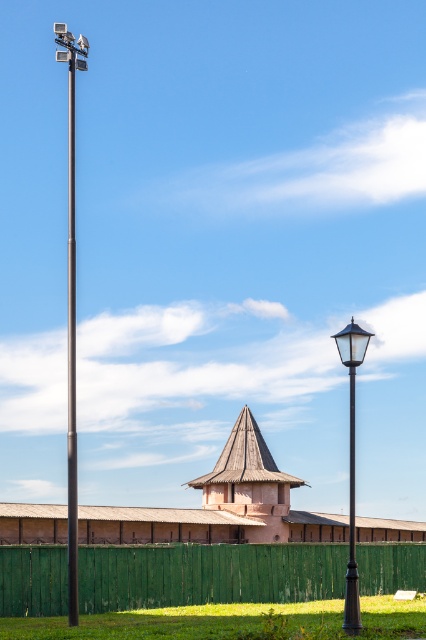
Question: Does green grass at lower center lie behind metallic pole at left?

Choices:
 (A) no
 (B) yes

Answer: (A)

Question: Which point is farther from the camera taking this photo?

Choices:
 (A) (69, 618)
 (B) (351, 490)
 (C) (298, 620)

Answer: (B)

Question: Which of the following is the closest to the observer?

Choices:
 (A) polished metal pole at center
 (B) metallic pole at left
 (C) black metal street light at right

Answer: (C)

Question: Can you confirm if green wooden fence at lower center is positioned above metallic pole at left?

Choices:
 (A) yes
 (B) no

Answer: (B)

Question: Does green wooden fence at lower center appear over metallic pole at left?

Choices:
 (A) yes
 (B) no

Answer: (B)

Question: Which point is farther to the camera?

Choices:
 (A) polished metal pole at center
 (B) green wooden fence at lower center
 (C) metallic pole at left

Answer: (A)